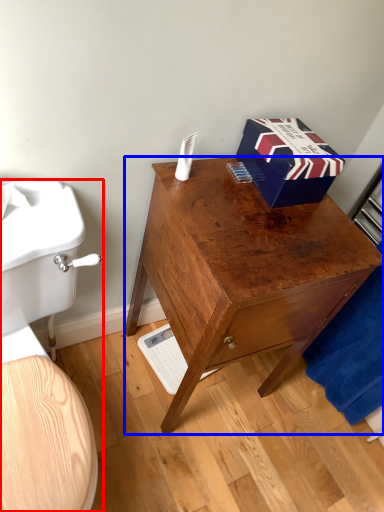
Question: Which object is further to the camera taking this photo, toilet (highlighted by a red box) or desk (highlighted by a blue box)?

Choices:
 (A) toilet
 (B) desk

Answer: (B)